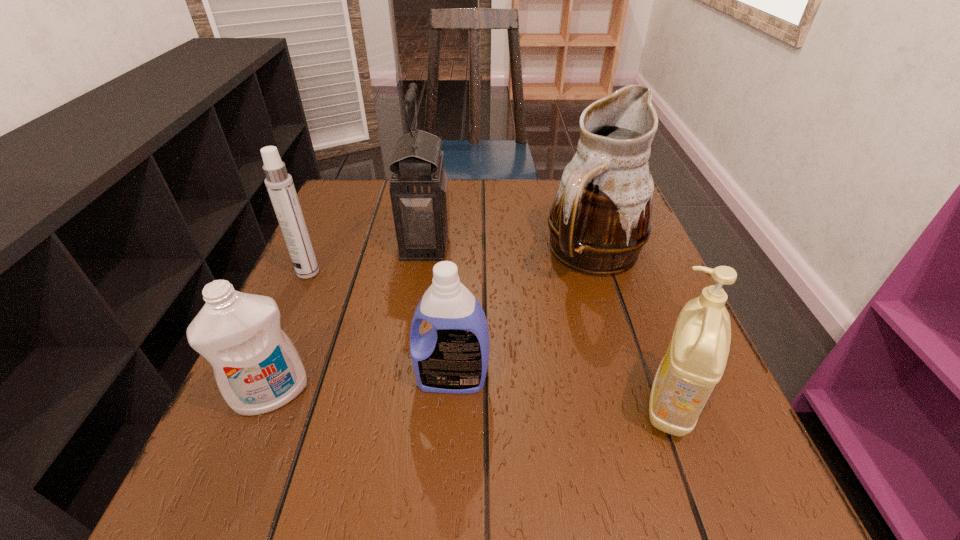
At what (x,y) coordinates should I click in order to perform the action: click on vacant area located 0.270m on the back of the leftmost detergent. Please return your answer as a coordinate pair (x, y). Looking at the image, I should click on (324, 270).

The height and width of the screenshot is (540, 960). Identify the location of free space located on the back of the rightmost detergent. (612, 244).

At what (x,y) coordinates should I click in order to perform the action: click on lantern present at the far edge. Please return your answer as a coordinate pair (x, y). Image resolution: width=960 pixels, height=540 pixels. Looking at the image, I should click on (419, 192).

In order to click on pitcher that is at the far edge in this screenshot , I will do `click(600, 219)`.

Locate an element on the screen. This screenshot has height=540, width=960. aerosol can located at the left edge is located at coordinates (279, 184).

Find the location of `detergent that is at the left edge`. detergent that is at the left edge is located at coordinates (257, 368).

The image size is (960, 540). What are the coordinates of `pitcher at the right edge` in the screenshot? It's located at (600, 219).

You are a GUI agent. You are given a task and a screenshot of the screen. Output one action in this format:
    pyautogui.click(x=<x>, y=<y>)
    Task: Click on the detergent present at the right edge
    
    Given the screenshot: What is the action you would take?
    pyautogui.click(x=695, y=360)

This screenshot has height=540, width=960. In order to click on object located at the far right corner in this screenshot , I will do `click(600, 219)`.

Locate an element on the screen. The height and width of the screenshot is (540, 960). blank space at the far edge of the desktop is located at coordinates (466, 219).